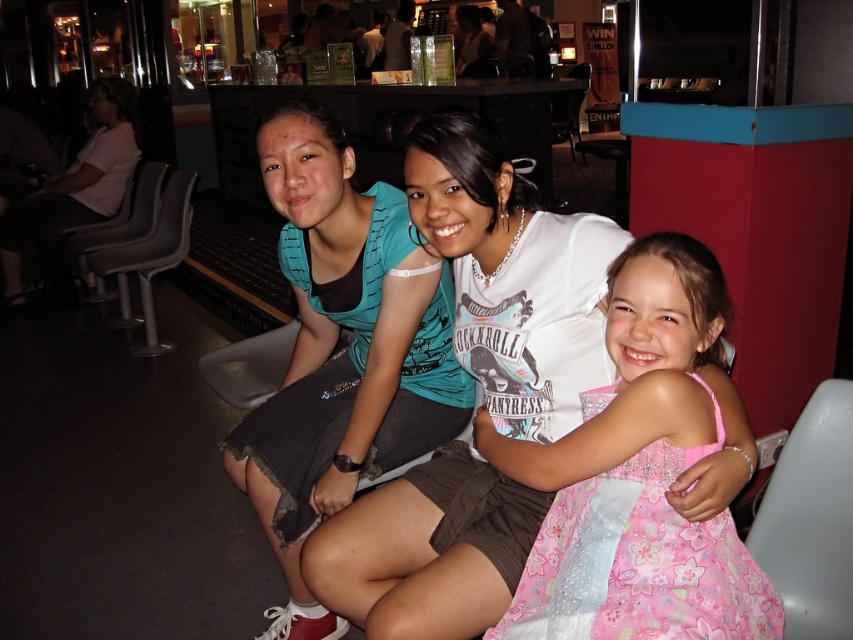
Is white plastic chair at lower right closer to camera compared to white plastic chair at center?

Yes.

Is point (799, 428) less distant than point (268, 356)?

Yes, point (799, 428) is closer to viewer.

This screenshot has width=853, height=640. In order to click on white plastic chair at lower right in this screenshot , I will do `click(811, 518)`.

Between point (100, 136) and point (96, 225), which one is positioned behind?

Positioned behind is point (100, 136).

Is matte white shirt at upper left positioned before gray fabric chair at left?

That is False.

Which is in front, point (107, 161) or point (140, 196)?

Point (140, 196) is in front.

The height and width of the screenshot is (640, 853). Identify the location of matte white shirt at upper left. (74, 184).

Between pink satin dress at center and gray plastic chair at left, which one has less height?

Standing shorter between the two is pink satin dress at center.

Between pink satin dress at center and gray plastic chair at left, which one is positioned lower?

pink satin dress at center is lower down.

Is point (672, 362) positioned in front of point (125, 276)?

That is True.

Image resolution: width=853 pixels, height=640 pixels. I want to click on pink satin dress at center, so click(x=637, y=476).